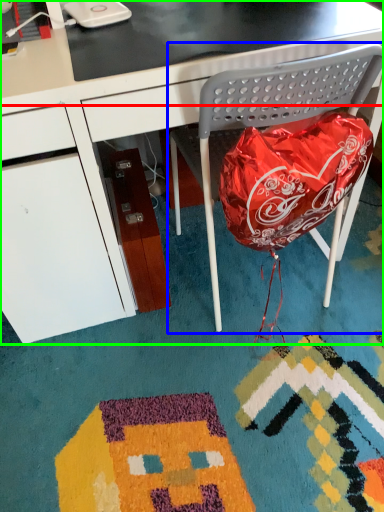
Question: Which object is the farthest from table top (highlighted by a red box)? Choose among these: folding chair (highlighted by a blue box) or desk (highlighted by a green box).

Choices:
 (A) folding chair
 (B) desk

Answer: (A)